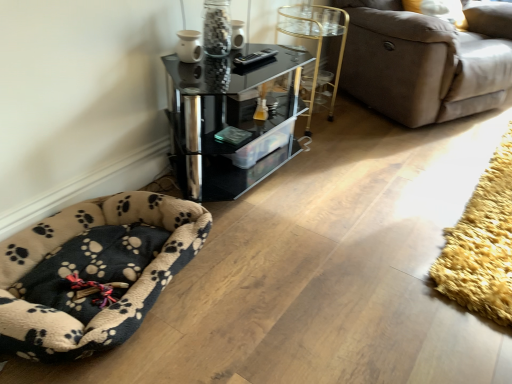
At what (x,y) coordinates should I click in order to perform the action: click on free spot to the right of black glass table at upper center. Please return your answer as a coordinate pair (x, y). Looking at the image, I should click on (339, 198).